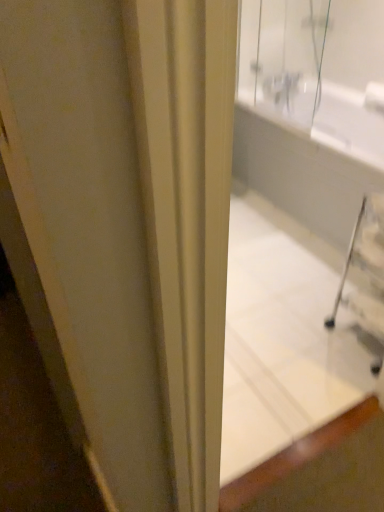
Describe the element at coordinates (301, 174) in the screenshot. Image resolution: width=384 pixels, height=512 pixels. I see `white glossy bathtub at upper right` at that location.

The width and height of the screenshot is (384, 512). I want to click on white glossy bathtub at upper right, so click(x=301, y=174).

Describe the element at coordinates (303, 223) in the screenshot. The width and height of the screenshot is (384, 512). I see `white glossy bathtub at center` at that location.

I want to click on white glossy bathtub at center, so point(303,223).

This screenshot has height=512, width=384. I want to click on white glossy bathtub at upper right, so click(301, 174).

Would you say white glossy bathtub at center is to the left or to the right of white glossy bathtub at upper right in the picture?

Clearly, white glossy bathtub at center is on the left of white glossy bathtub at upper right in the image.

Considering their positions, is white glossy bathtub at center located in front of or behind white glossy bathtub at upper right?

white glossy bathtub at center is in front of white glossy bathtub at upper right.

Is point (356, 329) closer to viewer compared to point (335, 203)?

Yes, point (356, 329) is in front of point (335, 203).

From the image's perspective, would you say white glossy bathtub at center is shown under white glossy bathtub at upper right?

Yes.

From a real-world perspective, who is located higher, white glossy bathtub at center or white glossy bathtub at upper right?

From a 3D spatial view, white glossy bathtub at center is above.

Based on the photo, which object is wider, white glossy bathtub at center or white glossy bathtub at upper right?

white glossy bathtub at upper right.

Considering the relative sizes of white glossy bathtub at center and white glossy bathtub at upper right in the image provided, is white glossy bathtub at center taller than white glossy bathtub at upper right?

Yes, white glossy bathtub at center is taller than white glossy bathtub at upper right.

Based on their sizes in the image, would you say white glossy bathtub at center is bigger or smaller than white glossy bathtub at upper right?

white glossy bathtub at center is smaller than white glossy bathtub at upper right.

Could white glossy bathtub at upper right be considered to be inside white glossy bathtub at center?

No, white glossy bathtub at upper right is not a part of white glossy bathtub at center.

Does white glossy bathtub at center touch white glossy bathtub at upper right?

white glossy bathtub at center and white glossy bathtub at upper right are clearly separated.

Could you tell me if white glossy bathtub at center is facing white glossy bathtub at upper right?

No, white glossy bathtub at center is not aimed at white glossy bathtub at upper right.

At what (x,y) coordinates should I click in order to perform the action: click on bath to the right of white glossy bathtub at center. Please return your answer as a coordinate pair (x, y). This screenshot has height=512, width=384. Looking at the image, I should click on (301, 174).

Which object is positioned more to the right, white glossy bathtub at upper right or white glossy bathtub at center?

Positioned to the right is white glossy bathtub at upper right.

Is the depth of white glossy bathtub at upper right less than that of white glossy bathtub at center?

No, white glossy bathtub at upper right is behind white glossy bathtub at center.

Considering the points (355, 187) and (342, 40), which point is in front, point (355, 187) or point (342, 40)?

The point (355, 187) is closer to the camera.

From the image's perspective, between white glossy bathtub at upper right and white glossy bathtub at center, which one is located above?

white glossy bathtub at upper right.

From a real-world perspective, which object rests below the other?

white glossy bathtub at upper right.

Is white glossy bathtub at upper right wider or thinner than white glossy bathtub at center?

Considering their sizes, white glossy bathtub at upper right looks broader than white glossy bathtub at center.

Considering the relative sizes of white glossy bathtub at upper right and white glossy bathtub at center in the image provided, is white glossy bathtub at upper right shorter than white glossy bathtub at center?

Yes.

Considering the sizes of white glossy bathtub at upper right and white glossy bathtub at center in the image, is white glossy bathtub at upper right bigger or smaller than white glossy bathtub at center?

Clearly, white glossy bathtub at upper right is larger in size than white glossy bathtub at center.

Do you think white glossy bathtub at upper right is within white glossy bathtub at center, or outside of it?

white glossy bathtub at upper right is outside white glossy bathtub at center.

Looking at this image, are white glossy bathtub at upper right and white glossy bathtub at center far apart?

No, white glossy bathtub at upper right is in close proximity to white glossy bathtub at center.

Is white glossy bathtub at upper right facing away from white glossy bathtub at center?

No.

From the picture: Can you tell me how much white glossy bathtub at upper right and white glossy bathtub at center differ in facing direction?

white glossy bathtub at upper right and white glossy bathtub at center are facing 88.4 degrees away from each other.

Measure the distance between white glossy bathtub at upper right and white glossy bathtub at center.

white glossy bathtub at upper right and white glossy bathtub at center are 8.82 inches apart.

I want to click on bath behind the white glossy bathtub at center, so click(301, 174).

You are a GUI agent. You are given a task and a screenshot of the screen. Output one action in this format:
    pyautogui.click(x=<x>, y=<y>)
    Task: Click on the bath that appears below the white glossy bathtub at center (from a real-world perspective)
    Image resolution: width=384 pixels, height=512 pixels.
    Given the screenshot: What is the action you would take?
    pyautogui.click(x=301, y=174)

The width and height of the screenshot is (384, 512). Find the location of `bathtub on the left of white glossy bathtub at upper right`. bathtub on the left of white glossy bathtub at upper right is located at coordinates (303, 223).